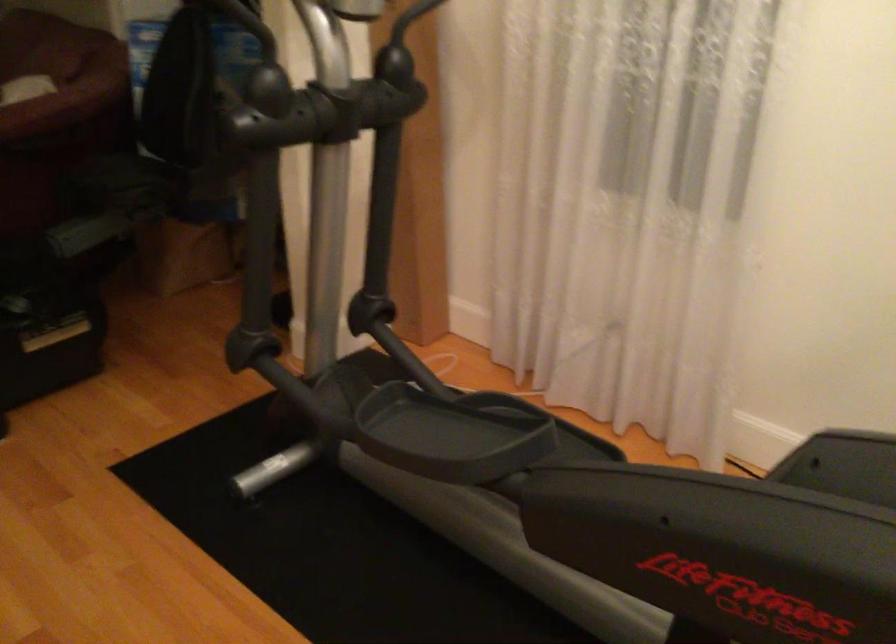
Question: The camera is either moving clockwise (left) or counter-clockwise (right) around the object. The first image is from the beginning of the video and the second image is from the end. Is the camera moving left or right when shooting the video?

Choices:
 (A) Left
 (B) Right

Answer: (B)